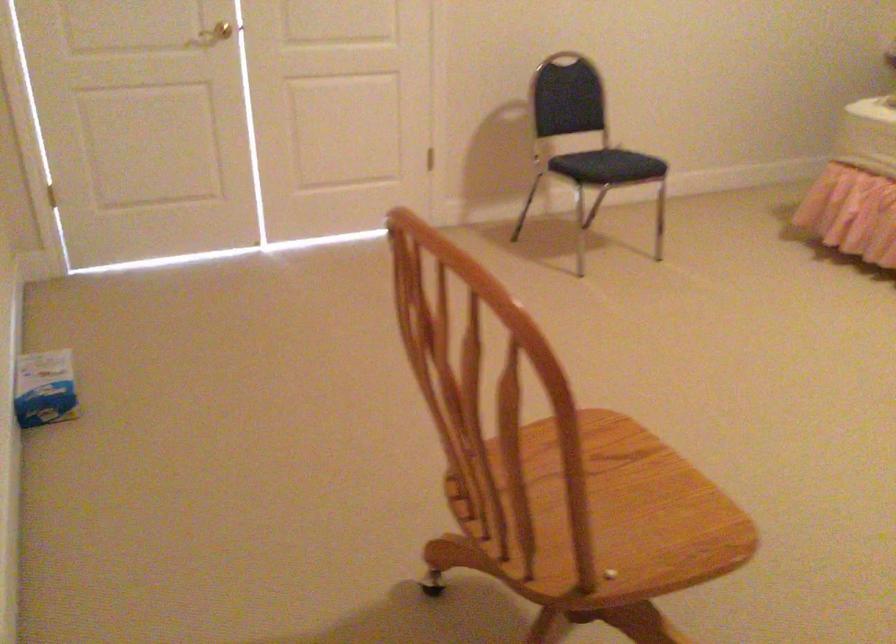
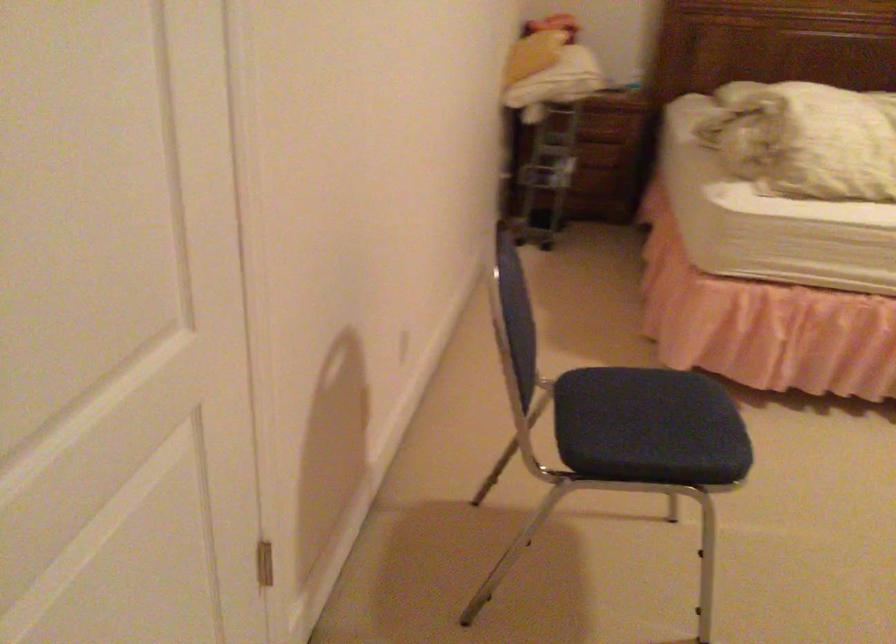
In the second image, find the point that corresponds to point (599, 158) in the first image.

(650, 433)